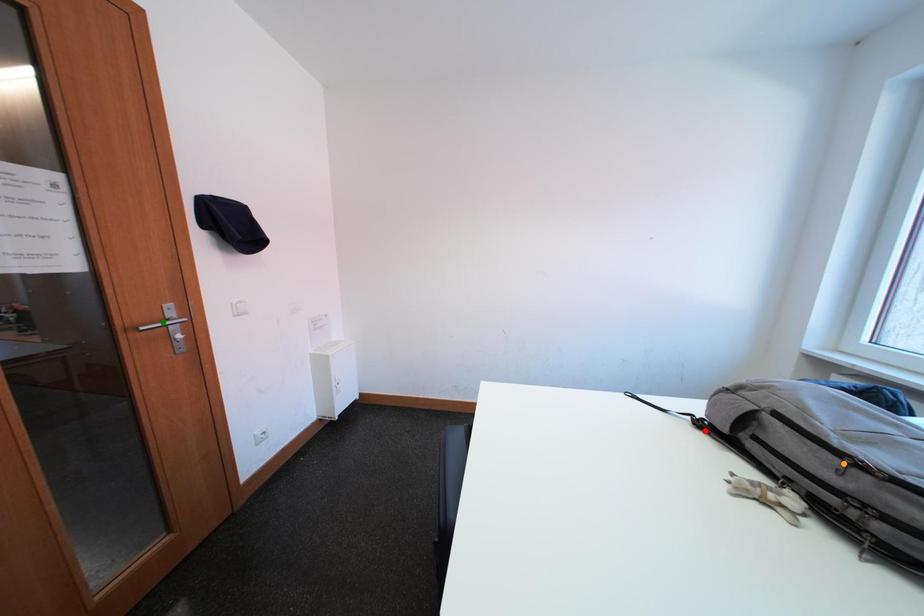
Order these from nearest to farthest:
- green point
- orange point
- red point

orange point, red point, green point